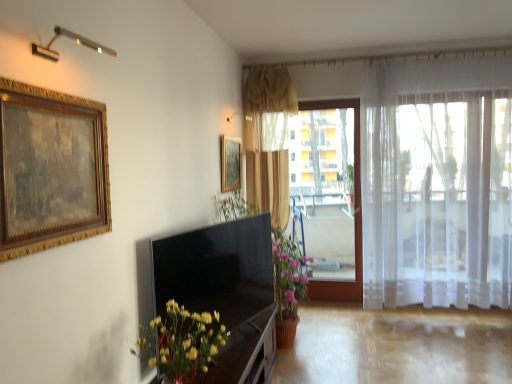
Question: Considering the relative positions of satin black tv at center and transparent plastic window screen at center in the image provided, is satin black tv at center to the right of transparent plastic window screen at center from the viewer's perspective?

Choices:
 (A) no
 (B) yes

Answer: (A)

Question: Can you confirm if satin black tv at center is wider than transparent plastic window screen at center?

Choices:
 (A) no
 (B) yes

Answer: (A)

Question: Is the position of satin black tv at center more distant than that of transparent plastic window screen at center?

Choices:
 (A) no
 (B) yes

Answer: (A)

Question: Can you confirm if satin black tv at center is thinner than transparent plastic window screen at center?

Choices:
 (A) no
 (B) yes

Answer: (B)

Question: Is satin black tv at center aimed at transparent plastic window screen at center?

Choices:
 (A) yes
 (B) no

Answer: (B)

Question: From a real-world perspective, is satin black tv at center on top of transparent plastic window screen at center?

Choices:
 (A) no
 (B) yes

Answer: (A)

Question: Considering the relative sizes of transparent plastic window screen at center and wooden dresser at lower center in the image provided, is transparent plastic window screen at center smaller than wooden dresser at lower center?

Choices:
 (A) no
 (B) yes

Answer: (B)

Question: Is transparent plastic window screen at center not near wooden dresser at lower center?

Choices:
 (A) yes
 (B) no

Answer: (A)

Question: Would you say transparent plastic window screen at center is outside wooden dresser at lower center?

Choices:
 (A) yes
 (B) no

Answer: (A)

Question: Can you confirm if transparent plastic window screen at center is thinner than wooden dresser at lower center?

Choices:
 (A) no
 (B) yes

Answer: (B)

Question: Does transparent plastic window screen at center have a larger size compared to wooden dresser at lower center?

Choices:
 (A) yes
 (B) no

Answer: (B)

Question: From the image's perspective, is transparent plastic window screen at center above wooden dresser at lower center?

Choices:
 (A) no
 (B) yes

Answer: (B)

Question: Is matte gold curtain at center, which is the first curtain in left-to-right order, beside wooden dresser at lower center?

Choices:
 (A) no
 (B) yes

Answer: (A)